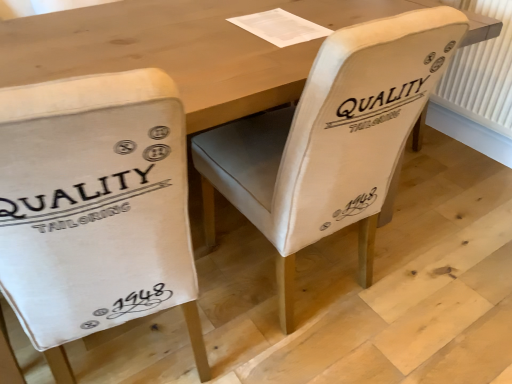
Find the location of `vacant space in between white canvas chair at left, which ranks as the 2th chair in right-to-left order, and white fabric chair at center, which appears as the first chair when viewed from the right`. vacant space in between white canvas chair at left, which ranks as the 2th chair in right-to-left order, and white fabric chair at center, which appears as the first chair when viewed from the right is located at coordinates (242, 321).